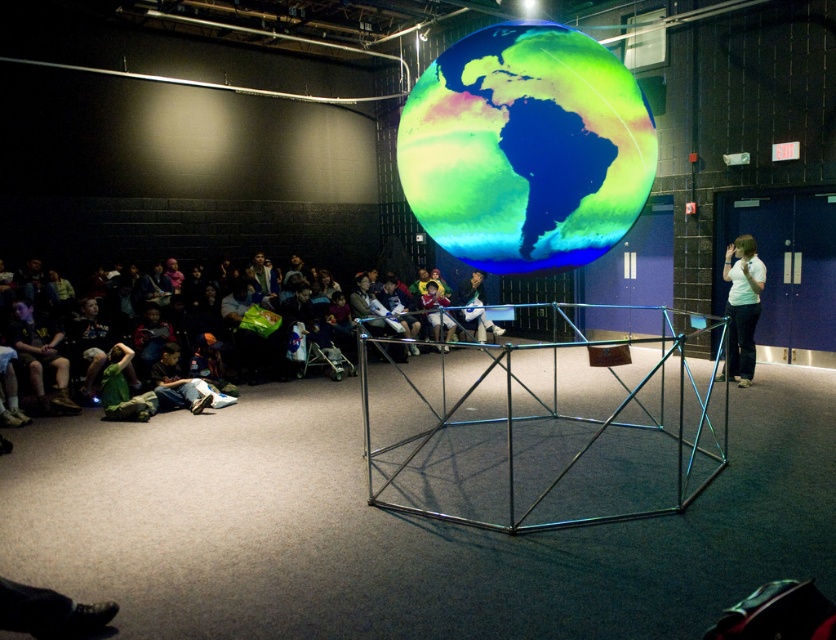
Who is more distant from viewer, [752,314] or [502,326]?

Point [502,326]

Identify the location of white shirt at right. Image resolution: width=836 pixels, height=640 pixels. pos(742,307).

Does point (55, 412) lie behind point (472, 323)?

No, (55, 412) is in front of (472, 323).

Where is `green fabric jacket at lower left`? green fabric jacket at lower left is located at coordinates (146, 330).

Is point (49, 291) behind point (478, 291)?

No, (49, 291) is closer to viewer.

You are a GUI agent. You are given a task and a screenshot of the screen. Output one action in this format:
    pyautogui.click(x=<x>, y=<y>)
    Task: Click on the green fabric jacket at lower left
    
    Given the screenshot: What is the action you would take?
    [x=146, y=330]

Which of these two, translucent plastic globe at center or blue denim jeans at center, stands taller?

Standing taller between the two is translucent plastic globe at center.

Who is positioned more to the left, translucent plastic globe at center or blue denim jeans at center?

From the viewer's perspective, translucent plastic globe at center appears more on the left side.

Who is more distant from viewer, (624, 120) or (467, 296)?

Point (467, 296)

The height and width of the screenshot is (640, 836). I want to click on translucent plastic globe at center, so click(x=524, y=148).